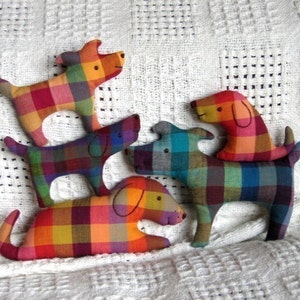
Identify the location of cushion. This screenshot has width=300, height=300. (213, 270).